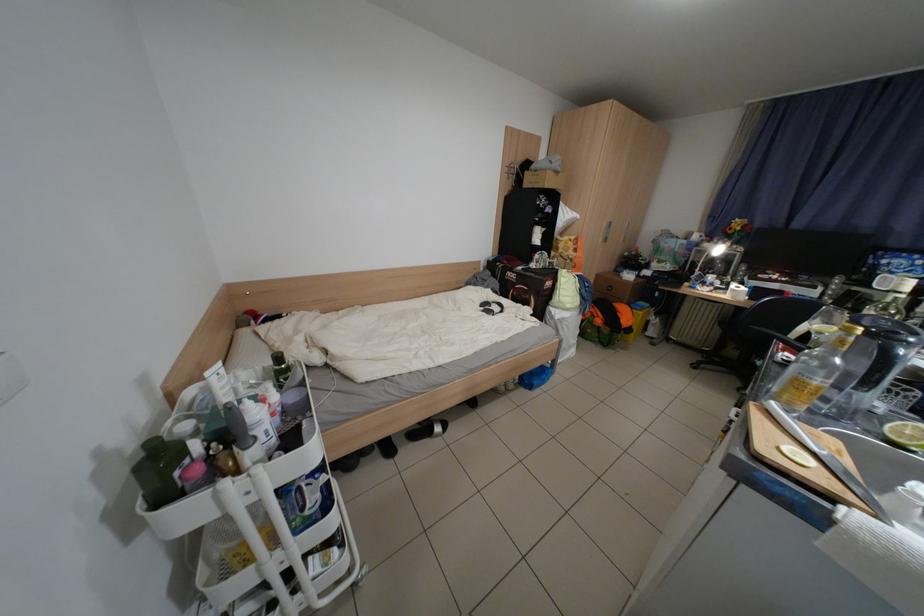
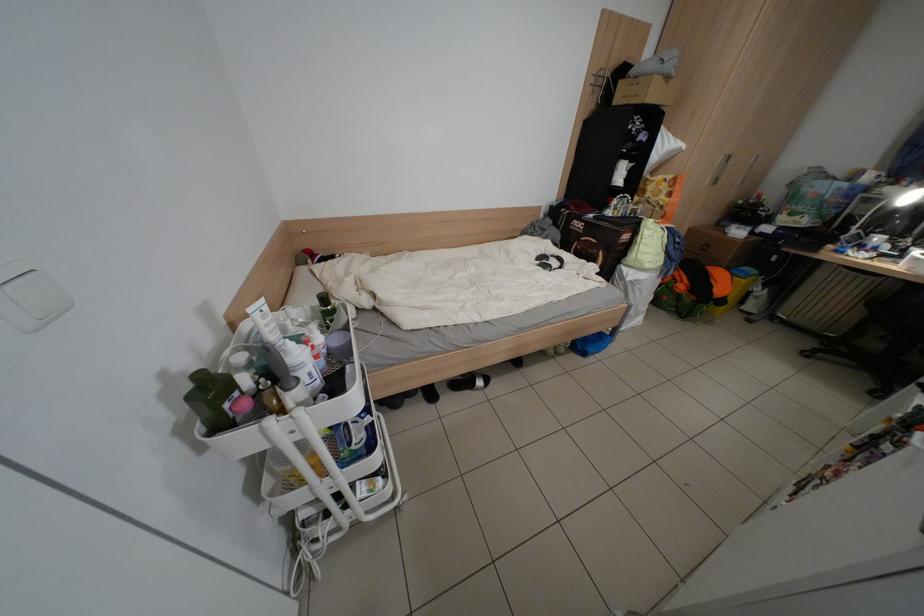
In the second image, find the point that corresponds to point (314, 509) in the first image.

(361, 445)